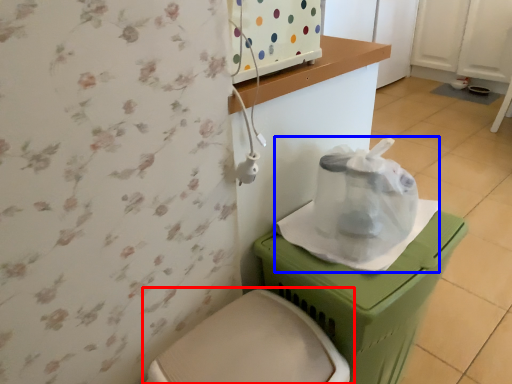
Question: Which point is closer to the camera, toilet (highlighted by a red box) or paper bag (highlighted by a blue box)?

Choices:
 (A) toilet
 (B) paper bag

Answer: (A)